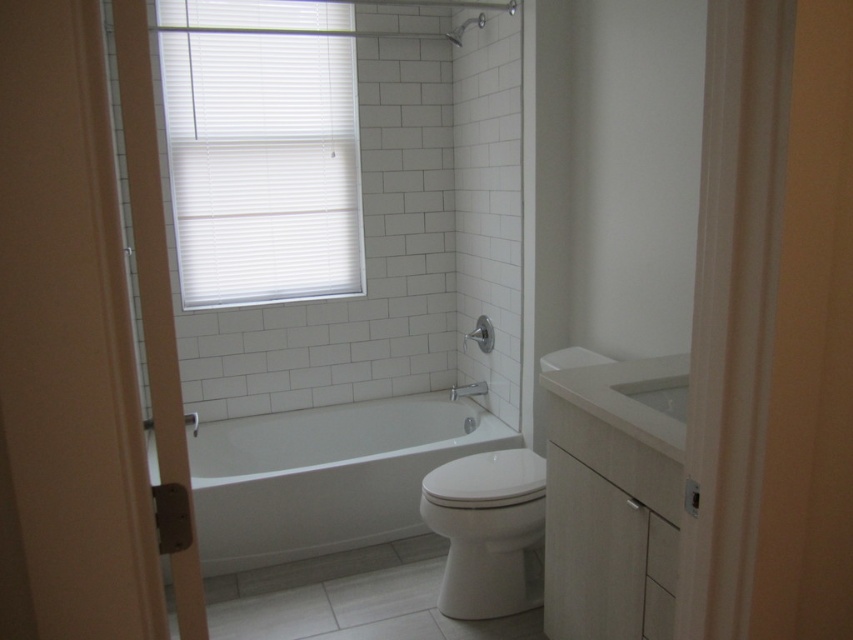
How distant is white blinds at upper left from matte white shower at center?

white blinds at upper left and matte white shower at center are 3.60 feet apart.

Is the position of white blinds at upper left more distant than that of matte white shower at center?

No, white blinds at upper left is closer to the viewer.

Between point (184, 1) and point (463, 337), which one is positioned behind?

The point (463, 337) is more distant.

Locate an element on the screen. The height and width of the screenshot is (640, 853). white blinds at upper left is located at coordinates (260, 148).

Which is more to the right, white glossy bathtub at center or matte silver showerhead at upper center?

From the viewer's perspective, matte silver showerhead at upper center appears more on the right side.

Between white glossy bathtub at center and matte silver showerhead at upper center, which one is positioned lower?

white glossy bathtub at center is below.

You are a GUI agent. You are given a task and a screenshot of the screen. Output one action in this format:
    pyautogui.click(x=<x>, y=<y>)
    Task: Click on the white glossy bathtub at center
    Image resolution: width=853 pixels, height=640 pixels.
    Given the screenshot: What is the action you would take?
    pyautogui.click(x=325, y=476)

Where is `white glossy bathtub at center`? The width and height of the screenshot is (853, 640). white glossy bathtub at center is located at coordinates [x=325, y=476].

Who is shorter, white blinds at upper left or white glossy sink at center?

With less height is white glossy sink at center.

Measure the distance between point (283, 29) and camera.

A distance of 3.14 meters exists between point (283, 29) and camera.

This screenshot has width=853, height=640. I want to click on white blinds at upper left, so click(260, 148).